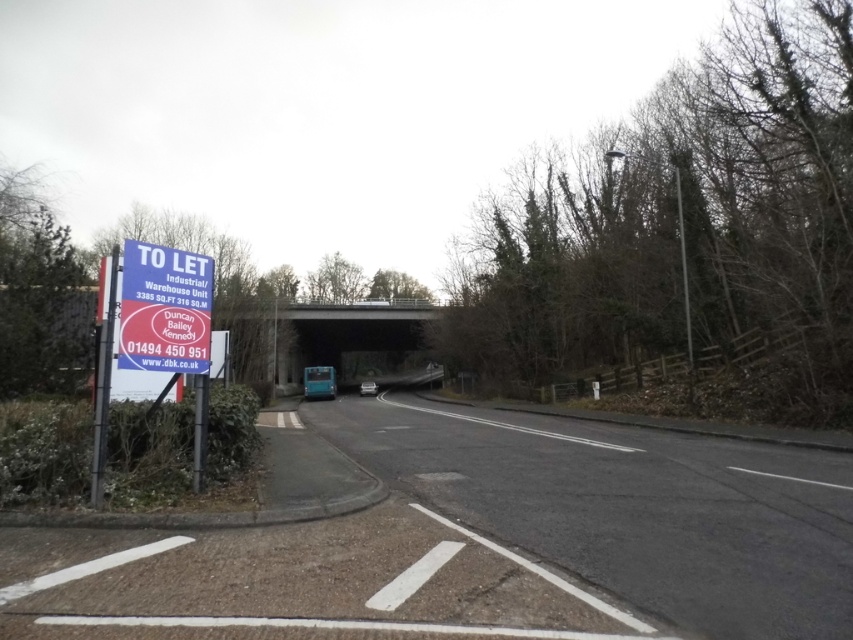
Is black asphalt road at center positioned behind blue plastic sign at left?

No.

Which is more to the right, black asphalt road at center or blue plastic sign at left?

black asphalt road at center is more to the right.

Is point (387, 464) farther from viewer compared to point (146, 259)?

Yes, it is.

This screenshot has height=640, width=853. I want to click on black asphalt road at center, so click(x=630, y=508).